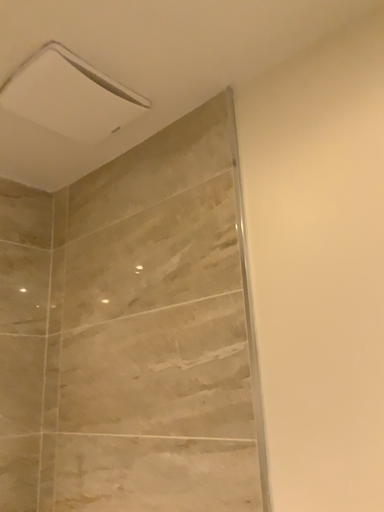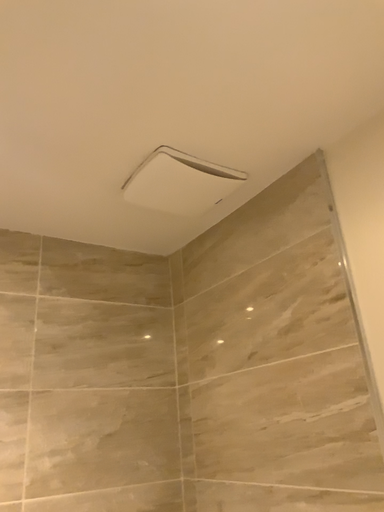
Question: Which way did the camera rotate in the video?

Choices:
 (A) rotated right
 (B) rotated left

Answer: (B)